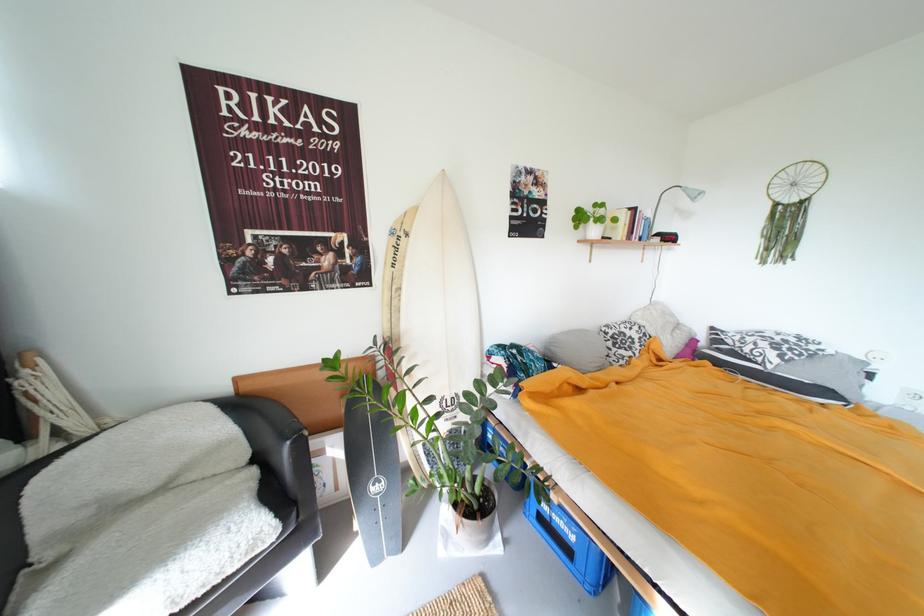
The image size is (924, 616). Describe the element at coordinates (694, 193) in the screenshot. I see `the gray lamp head` at that location.